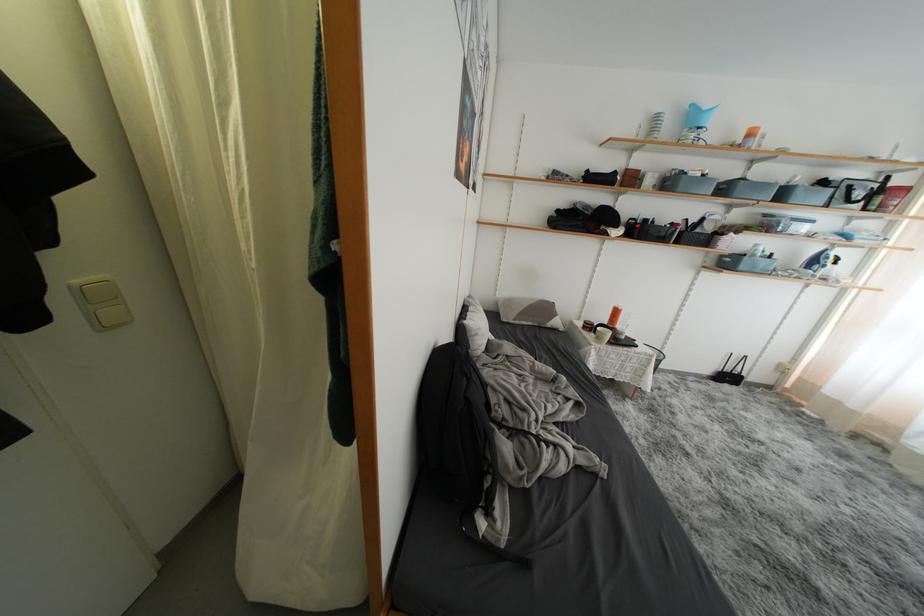
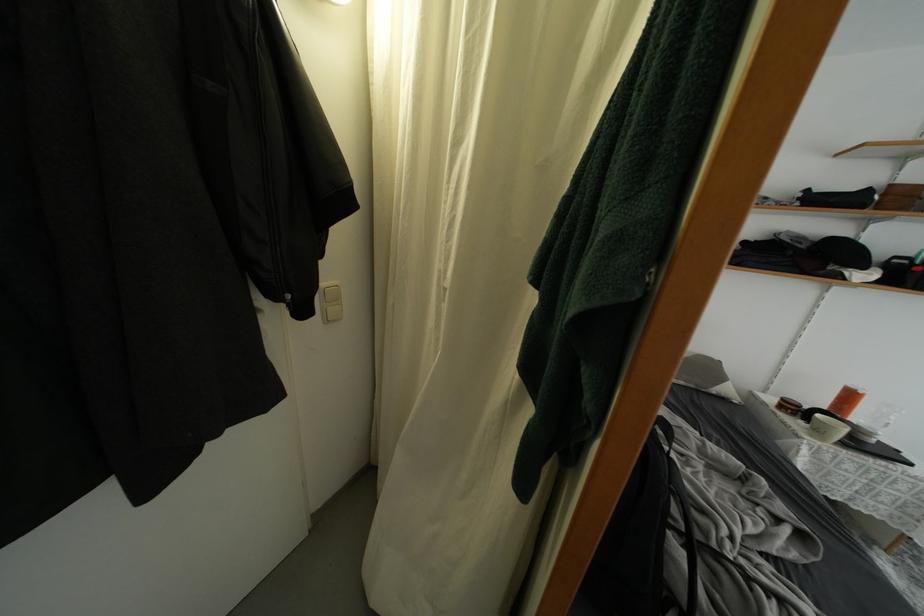
In the second image, find the point that corresponds to pixel 29 323 in the first image.

(310, 315)